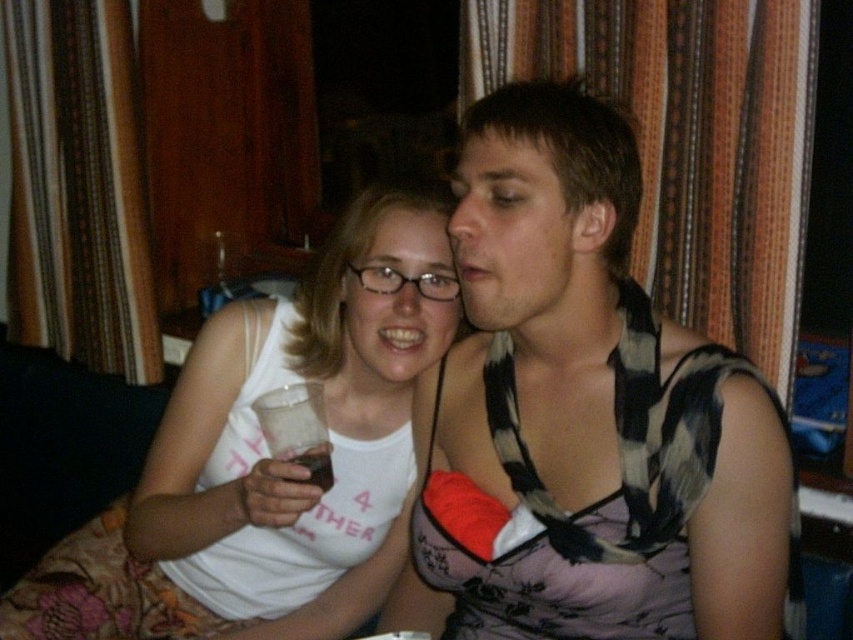
Is checkered fabric shirt at center bigger than white matte tank top at center?

Incorrect, checkered fabric shirt at center is not larger than white matte tank top at center.

Is point (563, 620) closer to camera compared to point (173, 506)?

Yes, it is in front of point (173, 506).

The width and height of the screenshot is (853, 640). Find the location of `checkered fabric shirt at center`. checkered fabric shirt at center is located at coordinates (584, 416).

Does checkered fabric shirt at center have a greater width compared to translucent plastic cup at lower center?

Correct, the width of checkered fabric shirt at center exceeds that of translucent plastic cup at lower center.

Is checkered fabric shirt at center smaller than translucent plastic cup at lower center?

No, checkered fabric shirt at center is not smaller than translucent plastic cup at lower center.

Which is behind, point (534, 467) or point (303, 451)?

The point (534, 467) is behind.

This screenshot has width=853, height=640. Identify the location of checkered fabric shirt at center. (584, 416).

Does white matte tank top at center appear under translucent plastic cup at lower center?

Indeed, white matte tank top at center is positioned under translucent plastic cup at lower center.

Who is more distant from viewer, (184, 440) or (320, 476)?

Positioned behind is point (184, 440).

Find the location of a particular element. This screenshot has height=640, width=853. white matte tank top at center is located at coordinates (325, 412).